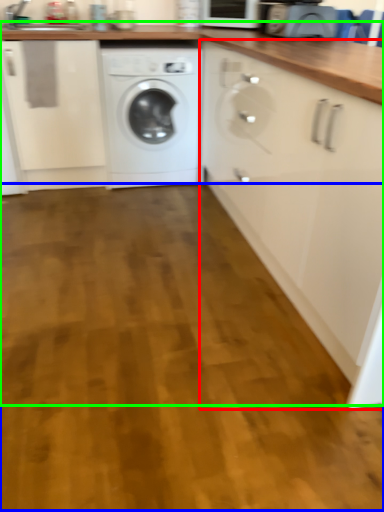
Question: Which object is positioned farthest from cabinetry (highlighted by a red box)? Select from plain (highlighted by a blue box) and counter (highlighted by a green box).

Choices:
 (A) plain
 (B) counter

Answer: (A)